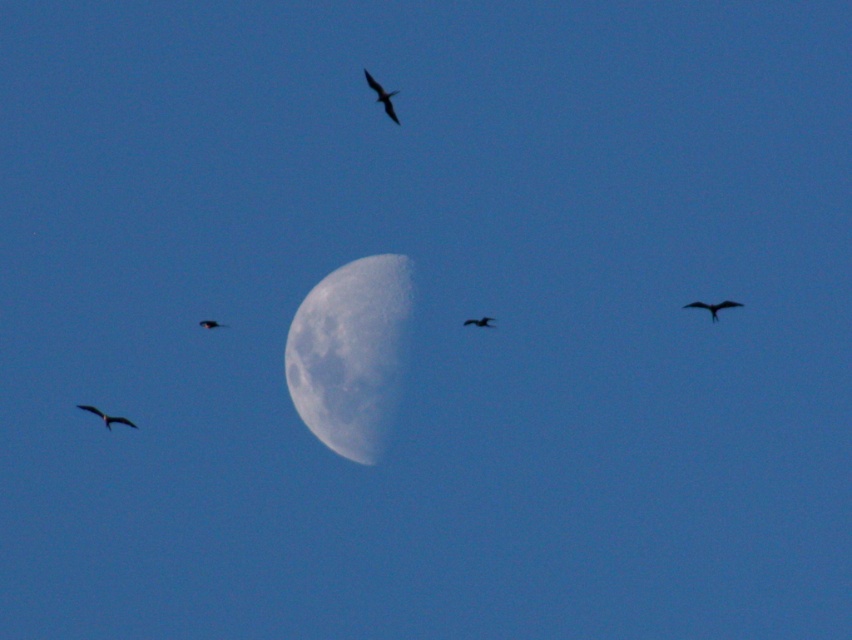
Is black matte bird at upper center to the right of silhouette glossy bird at center from the viewer's perspective?

In fact, black matte bird at upper center is to the left of silhouette glossy bird at center.

Between black matte bird at upper center and silhouette glossy bird at center, which one is positioned higher?

black matte bird at upper center

Is point (384, 106) positioned behind point (490, 326)?

No, it is not.

Find the location of a particular element. This screenshot has width=852, height=640. black matte bird at upper center is located at coordinates (383, 97).

Does black matte bird at lower left have a lesser height compared to matte black bird at upper center?

In fact, black matte bird at lower left may be taller than matte black bird at upper center.

Looking at this image, does black matte bird at lower left have a greater height compared to matte black bird at upper center?

Indeed, black matte bird at lower left has a greater height compared to matte black bird at upper center.

Is point (116, 417) behind point (199, 324)?

No, (116, 417) is in front of (199, 324).

You are a GUI agent. You are given a task and a screenshot of the screen. Output one action in this format:
    pyautogui.click(x=<x>, y=<y>)
    Task: Click on the black matte bird at lower left
    The width and height of the screenshot is (852, 640).
    Given the screenshot: What is the action you would take?
    pyautogui.click(x=106, y=417)

Does slightly grayish-white textured moon at center have a larger size compared to black matte bird at upper right?

Correct, slightly grayish-white textured moon at center is larger in size than black matte bird at upper right.

Between point (343, 291) and point (698, 301), which one is positioned behind?

Point (343, 291)

Identify the location of slightly grayish-white textured moon at center. The image size is (852, 640). (352, 353).